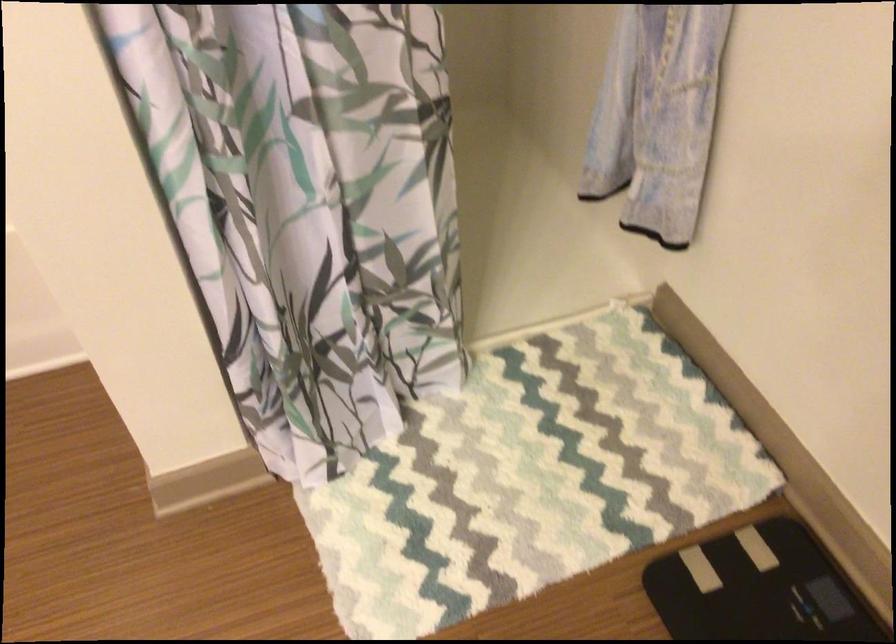
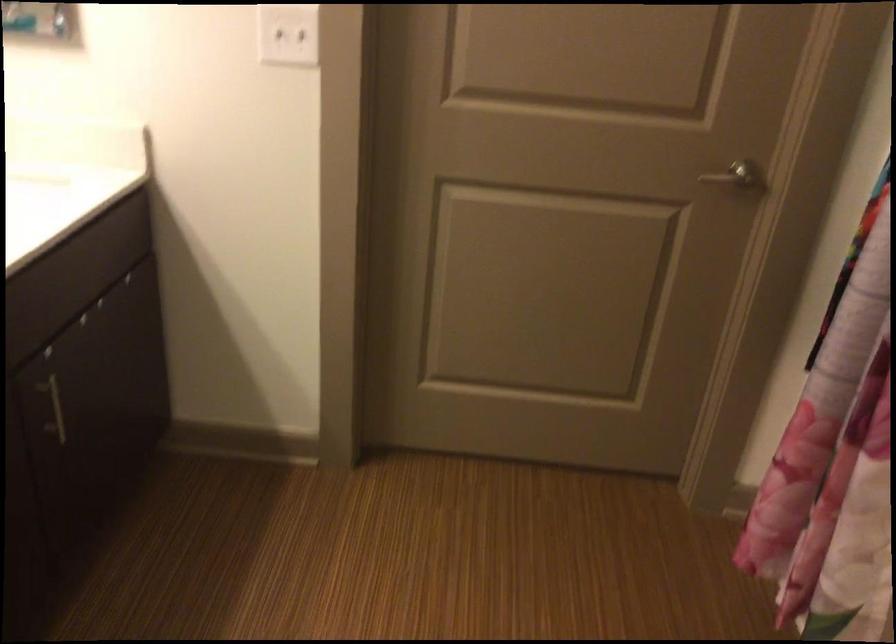
The images are taken continuously from a first-person perspective. In which direction is your viewpoint rotating?

The camera rotated toward left-down.